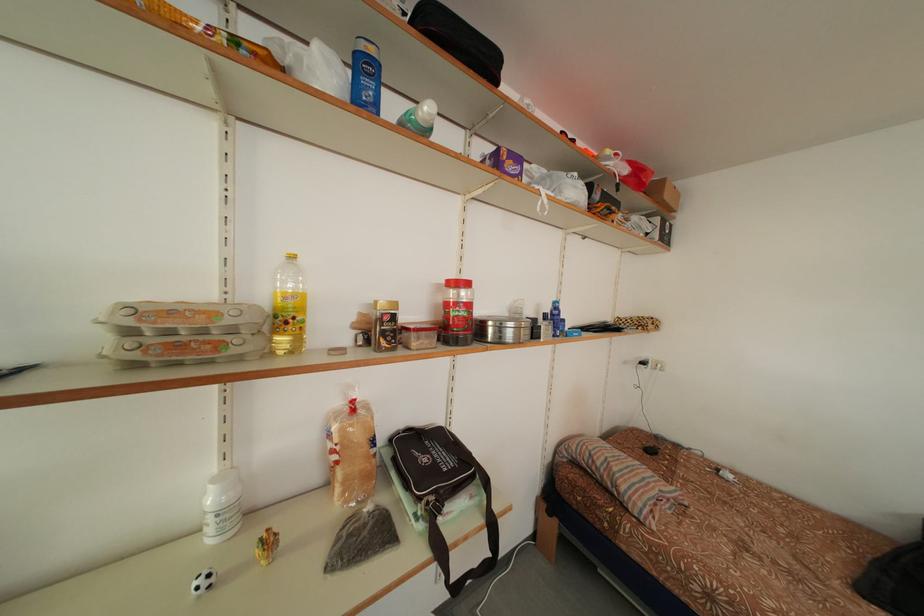
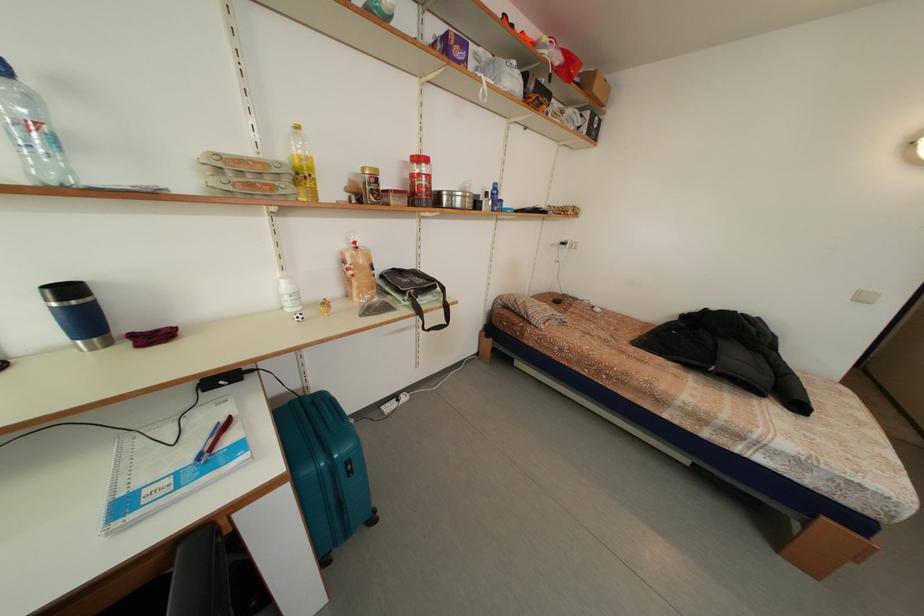
Find the pixel in the second image that matches pixel 360 407 in the first image.

(362, 248)